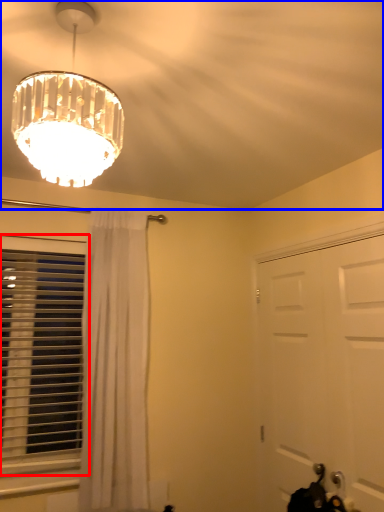
Question: Which object appears closest to the camera in this image, window (highlighted by a red box) or fan (highlighted by a blue box)?

Choices:
 (A) window
 (B) fan

Answer: (B)